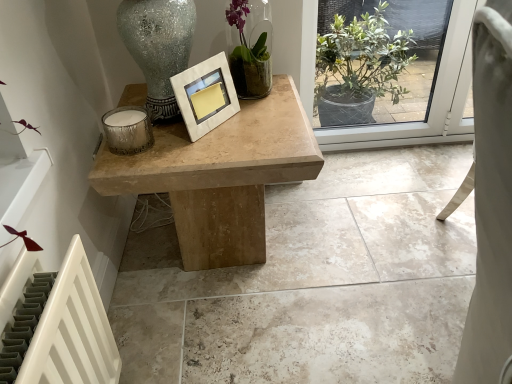
At what (x,y) coordinates should I click in order to perform the action: click on free point above natural stone table at center (from a real-world perspective). Please return your answer as a coordinate pair (x, y). Looking at the image, I should click on (x=328, y=256).